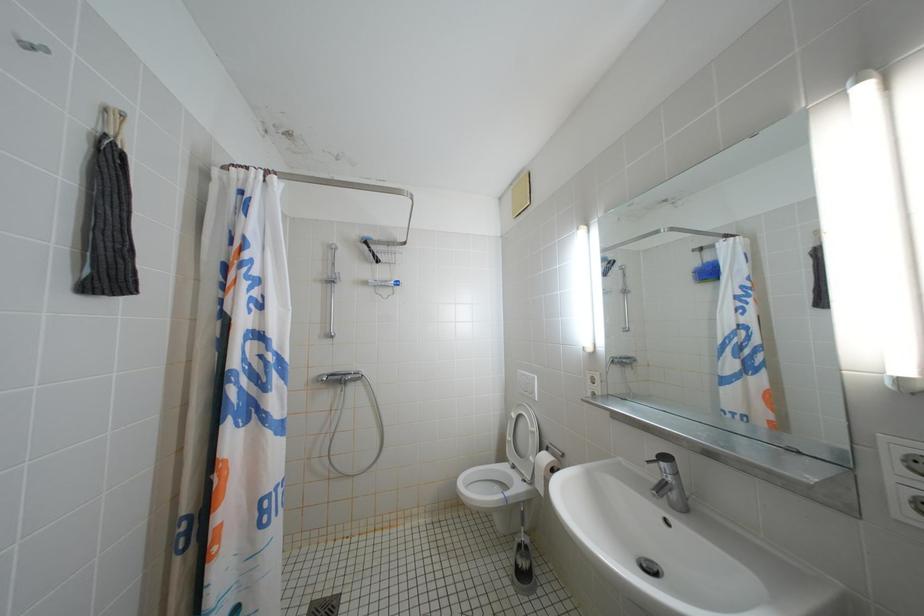
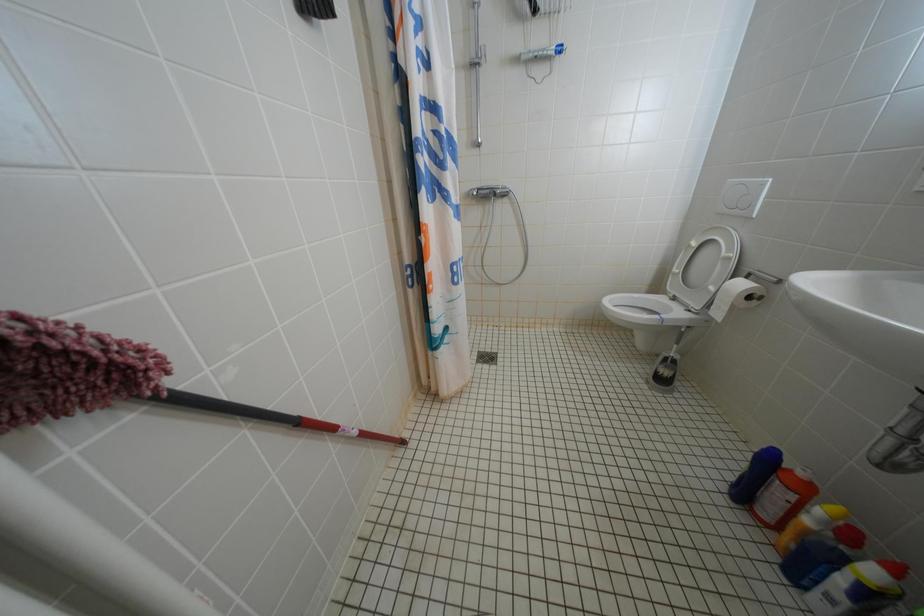
The first image is from the beginning of the video and the second image is from the end. How did the camera likely rotate when shooting the video?

The rotation direction of the camera is left-down.